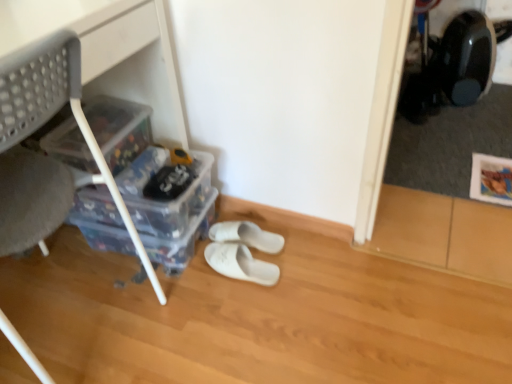
Question: Does white fabric slippers at center, which is the 1th footwear from back to front, appear on the right side of clear plastic storage box at left, arranged as the first storage box when viewed from the top?

Choices:
 (A) no
 (B) yes

Answer: (B)

Question: From the image's perspective, is white fabric slippers at center, which is the 1th footwear from back to front, on top of clear plastic storage box at left, arranged as the first storage box when viewed from the top?

Choices:
 (A) no
 (B) yes

Answer: (A)

Question: Does white fabric slippers at center, which is the 1th footwear from back to front, have a lesser width compared to clear plastic storage box at left, arranged as the first storage box when viewed from the top?

Choices:
 (A) yes
 (B) no

Answer: (B)

Question: Does white fabric slippers at center, which is the 1th footwear from back to front, come behind clear plastic storage box at left, which ranks as the 3th storage box in bottom-to-top order?

Choices:
 (A) yes
 (B) no

Answer: (A)

Question: From the image's perspective, is white fabric slippers at center, which is the 1th footwear from back to front, located beneath clear plastic storage box at left, arranged as the first storage box when viewed from the top?

Choices:
 (A) no
 (B) yes

Answer: (B)

Question: Is point (108, 24) positioned closer to the camera than point (242, 274)?

Choices:
 (A) farther
 (B) closer

Answer: (B)

Question: In terms of size, does white plastic chair at left appear bigger or smaller than white fabric slippers at center, the first footwear from the front?

Choices:
 (A) big
 (B) small

Answer: (A)

Question: In terms of height, does white plastic chair at left look taller or shorter compared to white fabric slippers at center, the first footwear from the front?

Choices:
 (A) tall
 (B) short

Answer: (A)

Question: Is white plastic chair at left situated inside white fabric slippers at center, marked as the 2th footwear in a back-to-front arrangement, or outside?

Choices:
 (A) outside
 (B) inside

Answer: (A)

Question: From their relative heights in the image, would you say white plastic chair at left is taller or shorter than transparent plastic storage box at lower left, positioned as the third storage box in top-to-bottom order?

Choices:
 (A) short
 (B) tall

Answer: (B)

Question: From the image's perspective, is white plastic chair at left located above or below transparent plastic storage box at lower left, the first storage box positioned from the bottom?

Choices:
 (A) below
 (B) above

Answer: (B)

Question: Is white plastic chair at left wider or thinner than transparent plastic storage box at lower left, positioned as the third storage box in top-to-bottom order?

Choices:
 (A) wide
 (B) thin

Answer: (A)

Question: Choose the correct answer: Is white plastic chair at left inside transparent plastic storage box at lower left, positioned as the third storage box in top-to-bottom order, or outside it?

Choices:
 (A) inside
 (B) outside

Answer: (B)

Question: Is white plastic chair at left to the left or to the right of white fabric slippers at center, which is counted as the second footwear, starting from the front, in the image?

Choices:
 (A) left
 (B) right

Answer: (A)

Question: Is point (55, 102) closer or farther from the camera than point (268, 236)?

Choices:
 (A) farther
 (B) closer

Answer: (B)